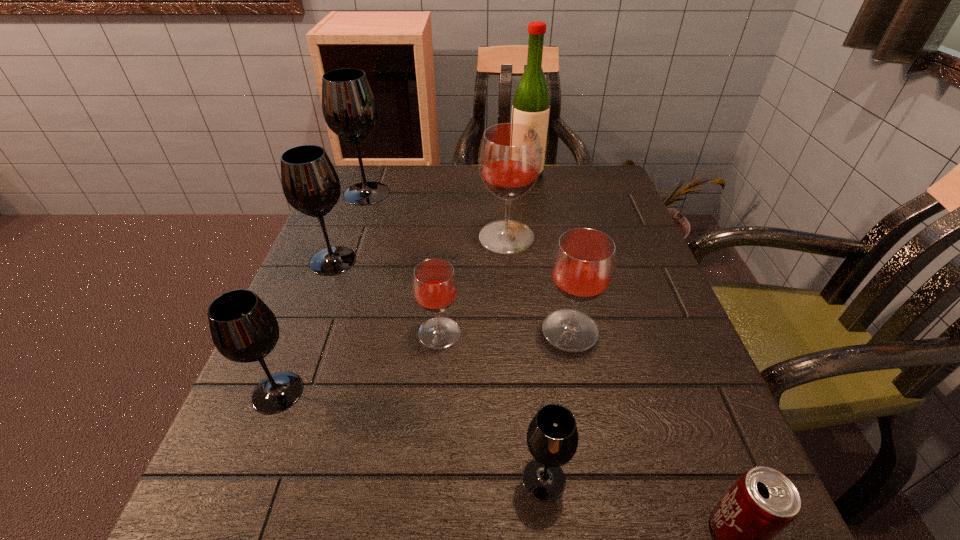
The image size is (960, 540). What are the coordinates of `free space at the far right corner of the desktop` in the screenshot? It's located at click(x=587, y=186).

Where is `free space at the near right corner of the desktop`? The width and height of the screenshot is (960, 540). free space at the near right corner of the desktop is located at coordinates (710, 533).

This screenshot has height=540, width=960. Find the location of `empty space that is in between the farthest gray wineglass and the green liquor`. empty space that is in between the farthest gray wineglass and the green liquor is located at coordinates (446, 183).

Locate an element on the screen. The image size is (960, 540). unoccupied position between the seventh farthest object and the second nearest object is located at coordinates (411, 436).

This screenshot has width=960, height=540. Identify the location of vacant space in between the farthest red wineglass and the second biggest gray wineglass. (420, 249).

Where is `unoccupied area between the fourth object from left to right and the second biggest red wineglass`? unoccupied area between the fourth object from left to right and the second biggest red wineglass is located at coordinates (505, 332).

Where is `unoccupied area between the farthest red wineglass and the tallest object`? The width and height of the screenshot is (960, 540). unoccupied area between the farthest red wineglass and the tallest object is located at coordinates click(516, 205).

At what (x,y) coordinates should I click in order to perform the action: click on unoccupied area between the biggest gray wineglass and the green liquor. Please return your answer as a coordinate pair (x, y). Looking at the image, I should click on pyautogui.click(x=446, y=183).

At what (x,y) coordinates should I click in order to perform the action: click on free space between the green liquor and the second nearest object. Please return your answer as a coordinate pair (x, y). Looking at the image, I should click on (535, 326).

At what (x,y) coordinates should I click in order to perform the action: click on vacant region between the nearest gray wineglass and the biggest red wineglass. Please return your answer as a coordinate pair (x, y). Looking at the image, I should click on (525, 358).